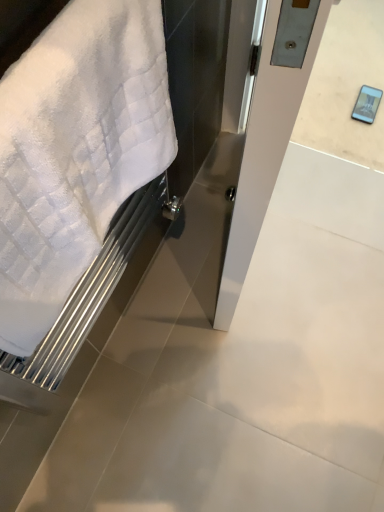
Find the location of a particular element. spots to the right of satin silver door at center is located at coordinates (318, 230).